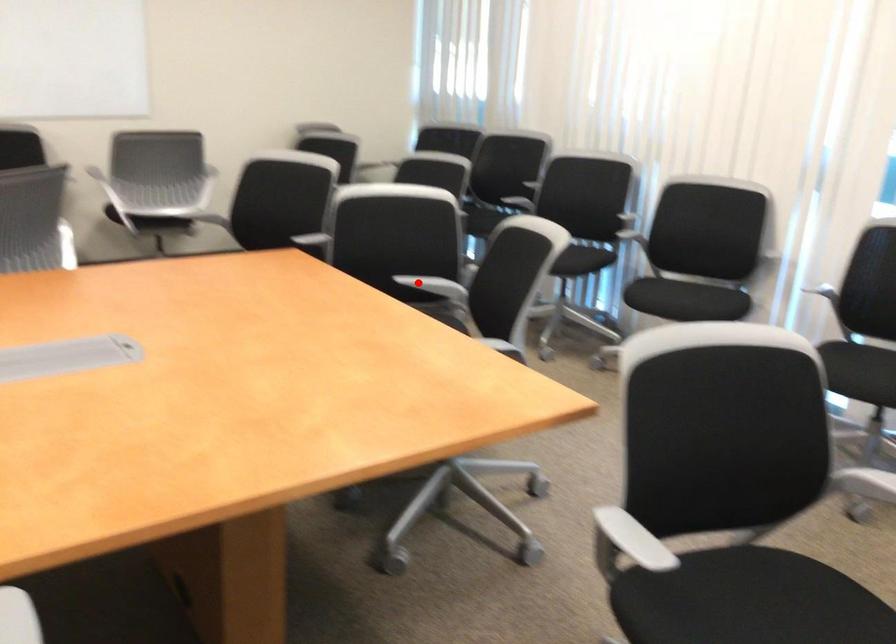
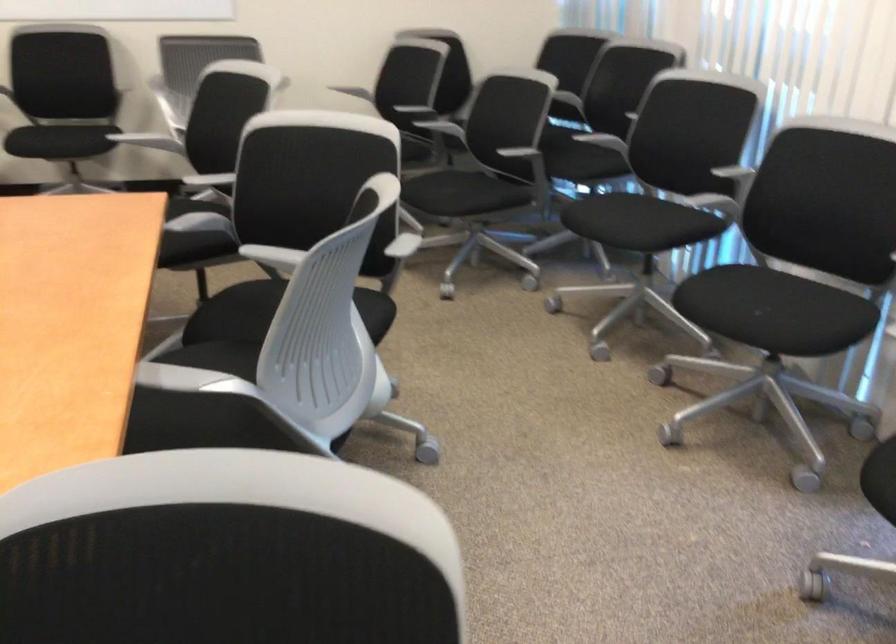
Question: I am providing you with two images of the same scene from different viewpoints. A red point is marked on the first image. Can you still see the location of the red point in image 2?

Choices:
 (A) Yes
 (B) No

Answer: (A)